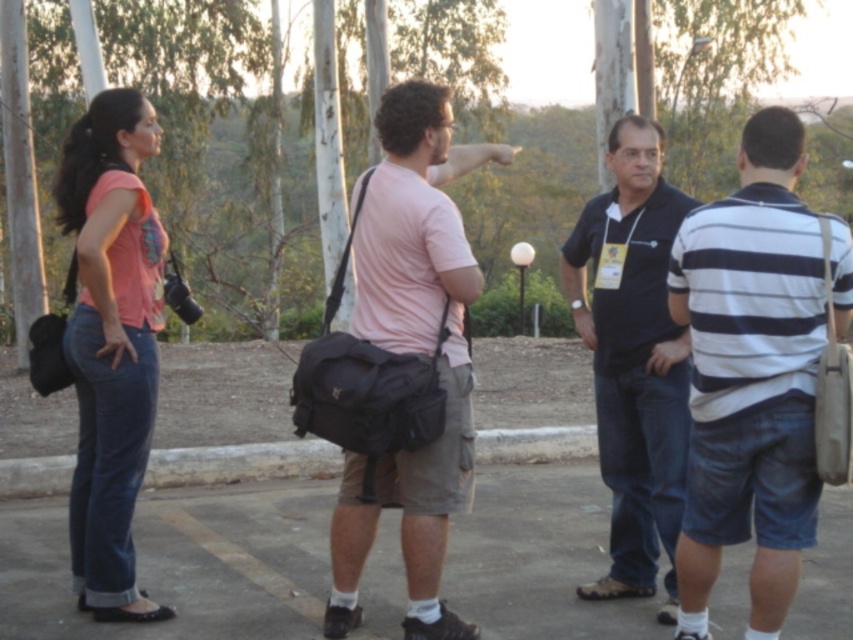
Which is behind, point (108, 108) or point (682, 460)?

The point (682, 460) is behind.

Does matte pink shirt at left appear on the right side of dark blue shirt at center?

In fact, matte pink shirt at left is to the left of dark blue shirt at center.

Is point (96, 538) closer to viewer compared to point (656, 316)?

Yes, it is in front of point (656, 316).

At what (x,y) coordinates should I click in order to perform the action: click on matte pink shirt at left. Please return your answer as a coordinate pair (x, y). The height and width of the screenshot is (640, 853). Looking at the image, I should click on (111, 342).

Is point (726, 451) farther from camera compared to point (119, 356)?

No, (726, 451) is in front of (119, 356).

Which is behind, point (753, 232) or point (149, 323)?

Positioned behind is point (149, 323).

Where is `white striped shirt at right`? The width and height of the screenshot is (853, 640). white striped shirt at right is located at coordinates (750, 376).

Can you confirm if pink matte t-shirt at center is wider than dark blue shirt at center?

Indeed, pink matte t-shirt at center has a greater width compared to dark blue shirt at center.

Can you confirm if pink matte t-shirt at center is positioned below dark blue shirt at center?

No.

The image size is (853, 640). I want to click on pink matte t-shirt at center, so click(x=412, y=353).